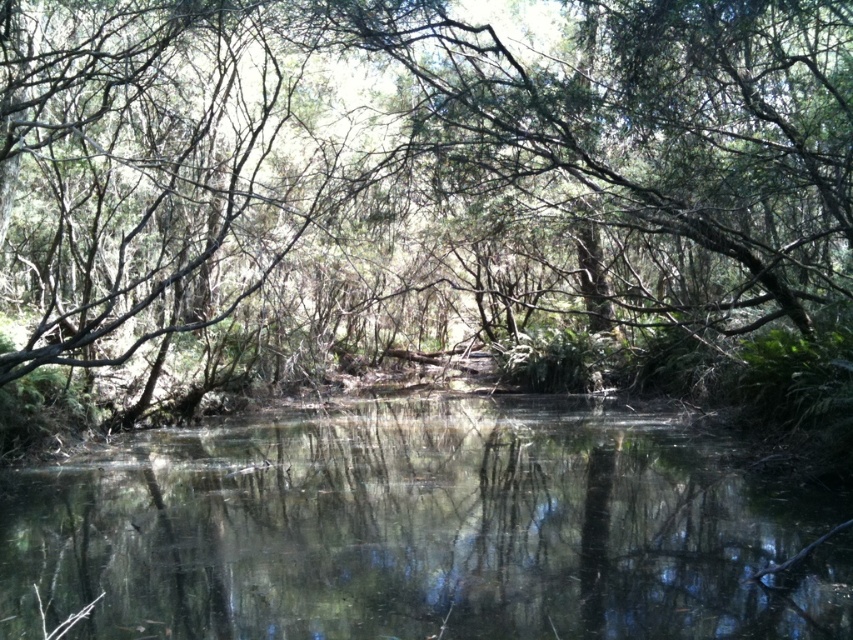
Who is shorter, green leafy tree at center or clear water at center?

clear water at center

Is green leafy tree at center shorter than clear water at center?

In fact, green leafy tree at center may be taller than clear water at center.

Where is `green leafy tree at center`? This screenshot has width=853, height=640. green leafy tree at center is located at coordinates (425, 160).

The width and height of the screenshot is (853, 640). I want to click on green leafy tree at center, so click(425, 160).